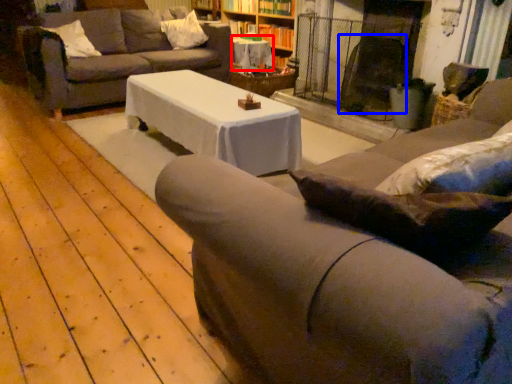
Question: Which of the following is the farthest to the observer, table (highlighted by a red box) or swivel chair (highlighted by a blue box)?

Choices:
 (A) table
 (B) swivel chair

Answer: (A)